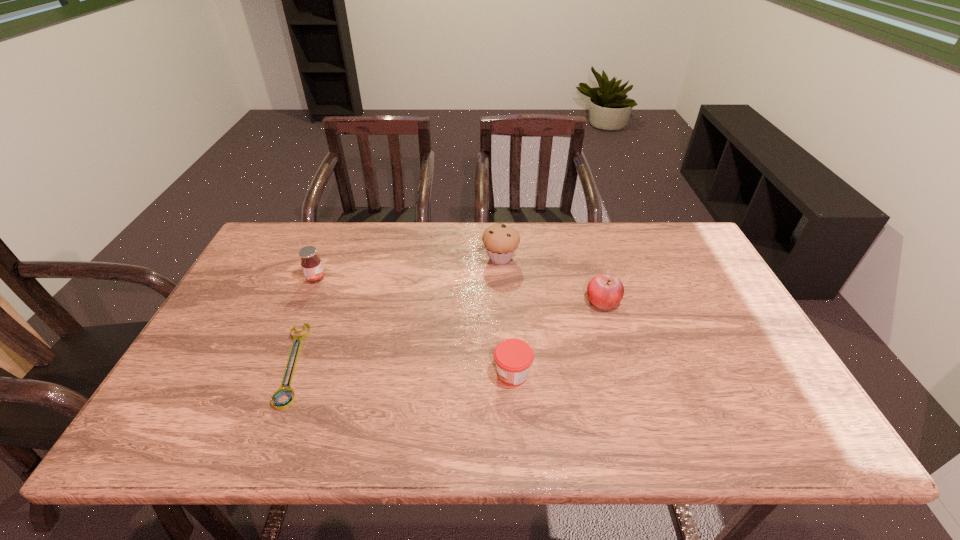
In the image, there is a desktop. Where is `vacant area at the far right corner`? vacant area at the far right corner is located at coordinates (689, 256).

The height and width of the screenshot is (540, 960). In order to click on vacant space in between the muffin and the shortest object in this screenshot , I will do `click(396, 311)`.

Locate an element on the screen. This screenshot has width=960, height=540. vacant space that's between the muffin and the third farthest object is located at coordinates (552, 280).

Locate an element on the screen. free space that is in between the taller jam and the rightmost object is located at coordinates (460, 290).

This screenshot has height=540, width=960. I want to click on vacant space in between the wrench and the nearer jam, so click(x=403, y=368).

I want to click on vacant area that lies between the left jam and the farthest object, so click(408, 268).

The image size is (960, 540). I want to click on vacant region between the shorter jam and the wrench, so click(403, 368).

The image size is (960, 540). I want to click on blank region between the farthest object and the farther jam, so click(x=408, y=268).

Identify the location of vacant space that's between the shorter jam and the shortest object. The image size is (960, 540). (403, 368).

Where is `vacant area that lies between the apple and the shorter jam`? The width and height of the screenshot is (960, 540). vacant area that lies between the apple and the shorter jam is located at coordinates (558, 337).